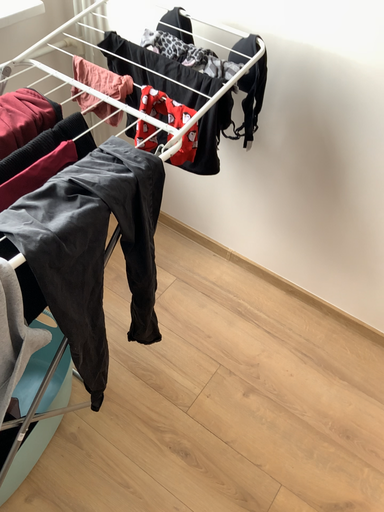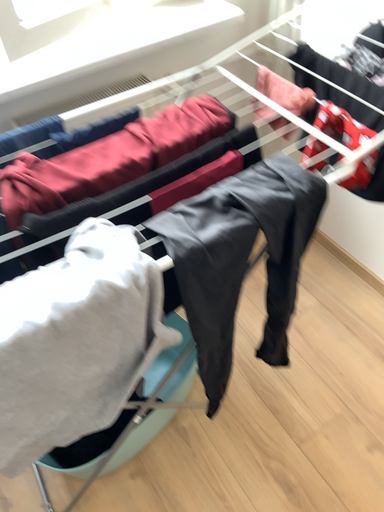
Question: How did the camera likely rotate when shooting the video?

Choices:
 (A) rotated right
 (B) rotated left

Answer: (B)